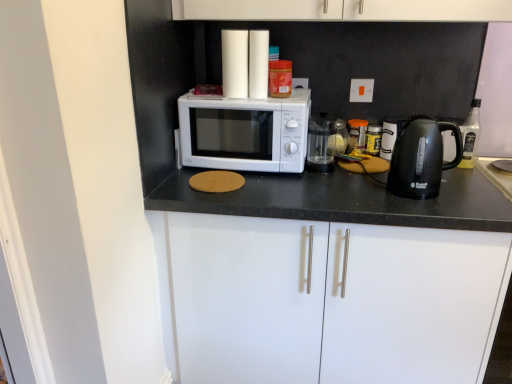
Where is `blank space situated above white matte cabinet at center, which is the second cabinetry from top to bottom (from a real-world perspective)`? blank space situated above white matte cabinet at center, which is the second cabinetry from top to bottom (from a real-world perspective) is located at coordinates (388, 179).